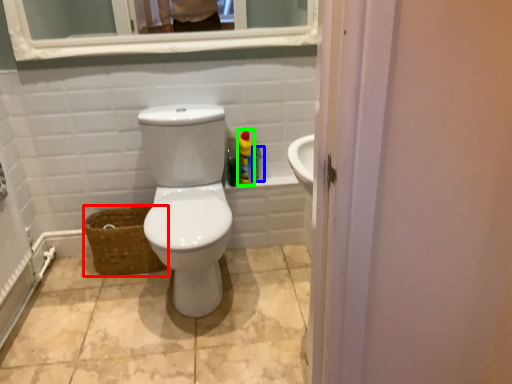
Question: Based on their relative distances, which object is nearer to basket (highlighted by a red box)? Choose from cleaning product (highlighted by a blue box) and cleaning product (highlighted by a green box).

Choices:
 (A) cleaning product
 (B) cleaning product

Answer: (B)